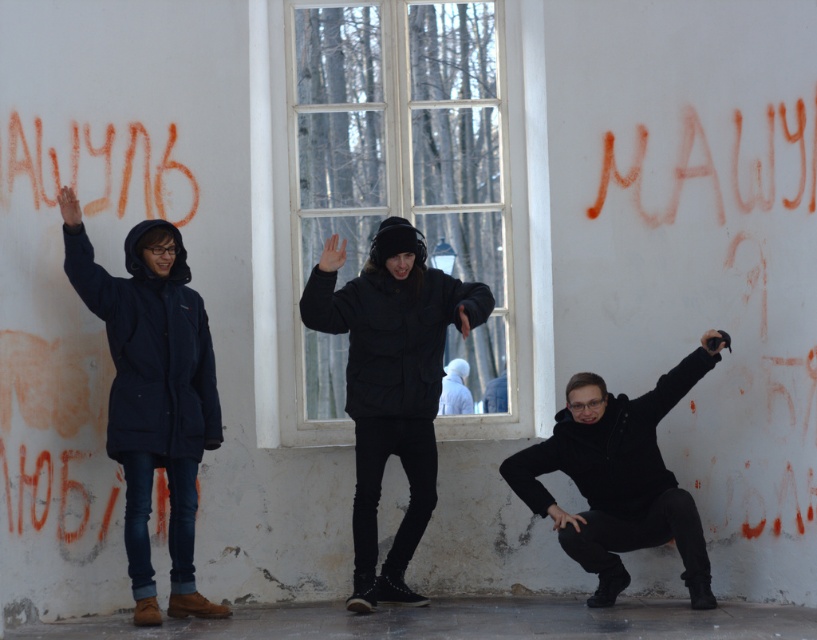
Who is more forward, (132, 234) or (393, 362)?

Point (132, 234)

Who is positioned more to the right, navy blue parka at left or black matte jacket at center?

black matte jacket at center is more to the right.

Does point (137, 256) lie in front of point (382, 264)?

Yes.

Find the location of a particular element. Image resolution: width=817 pixels, height=640 pixels. navy blue parka at left is located at coordinates (152, 394).

Which is in front, point (186, 556) or point (563, 541)?

Point (563, 541) is more forward.

Does navy blue parka at left have a larger size compared to black matte jacket at lower right?

Yes, navy blue parka at left is bigger than black matte jacket at lower right.

Between point (132, 305) and point (717, 352), which one is positioned behind?

The point (717, 352) is behind.

This screenshot has height=640, width=817. What are the coordinates of `navy blue parka at left` in the screenshot? It's located at (152, 394).

Is black matte jacket at center to the left of black matte jacket at lower right from the viewer's perspective?

Yes, black matte jacket at center is to the left of black matte jacket at lower right.

Is point (422, 524) positioned after point (639, 460)?

That is True.

Identify the location of black matte jacket at center. The image size is (817, 640). (391, 384).